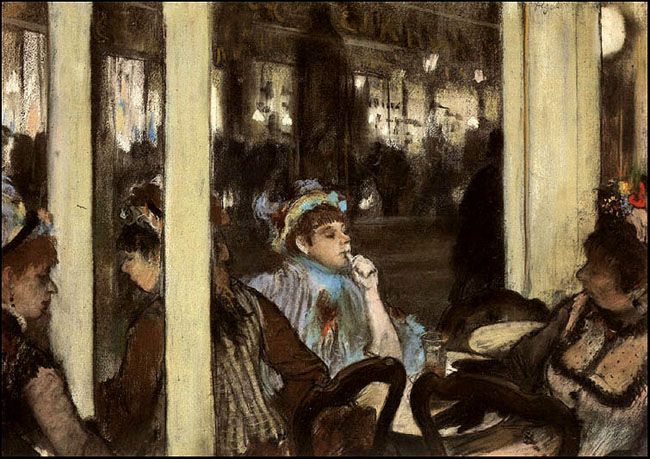
You are a GUI agent. You are given a task and a screenshot of the screen. Output one action in this format:
    pyautogui.click(x=<x>, y=<y>)
    Task: Click on the floor
    The image size is (650, 459).
    Given the screenshot: What is the action you would take?
    pyautogui.click(x=424, y=292)